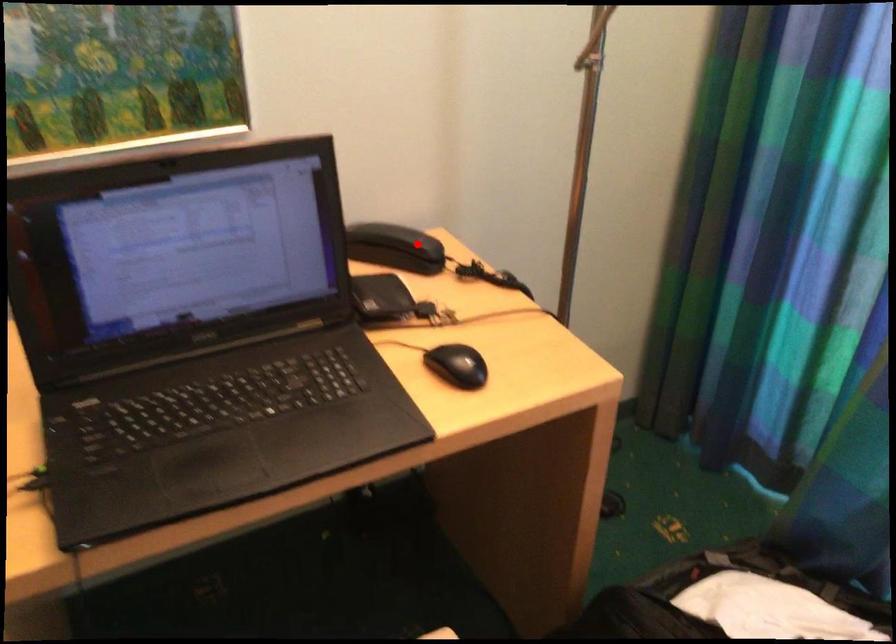
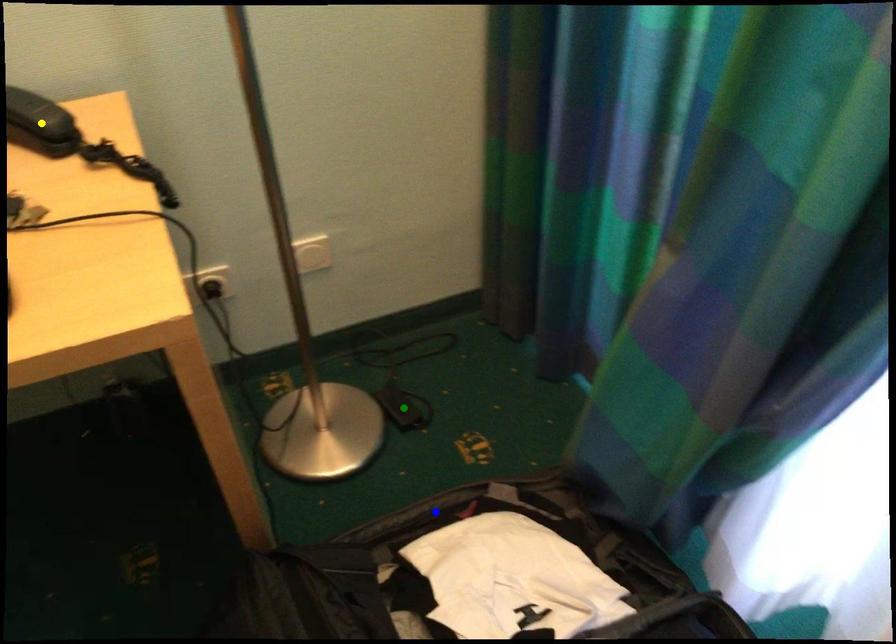
Question: I am providing you with two images of the same scene from different viewpoints. A red point is marked on the first image. You are given multiple points on the second image. In image 2, which mark is for the same physical point as the one in image 1?

Choices:
 (A) blue point
 (B) green point
 (C) yellow point

Answer: (C)